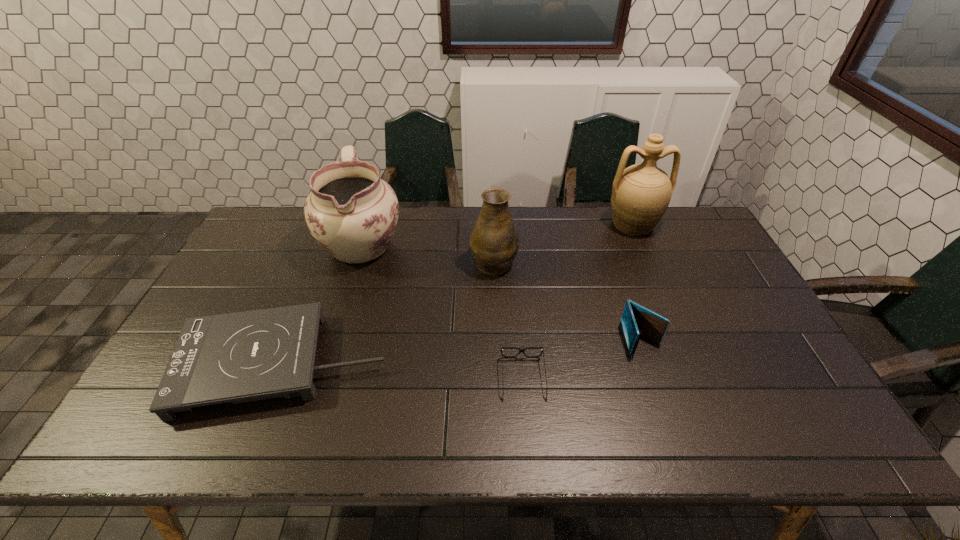
Find the location of `vacant space at the near edge of the desktop`. vacant space at the near edge of the desktop is located at coordinates (359, 440).

I want to click on vacant point at the right edge, so click(715, 253).

Locate an element on the screen. empty space that is in between the shortest object and the leftmost pitcher is located at coordinates (443, 310).

Locate an element on the screen. The width and height of the screenshot is (960, 540). vacant region between the spectacles and the leftmost pitcher is located at coordinates (443, 310).

I want to click on free space between the wallet and the second pitcher from left to right, so click(x=567, y=300).

Locate an element on the screen. The image size is (960, 540). free space between the wallet and the leftmost pitcher is located at coordinates tap(501, 292).

Locate an element on the screen. vacant region between the hotplate and the second pitcher from left to right is located at coordinates (388, 312).

Find the location of a particular element. The height and width of the screenshot is (540, 960). free spot between the spectacles and the second pitcher from right to left is located at coordinates coord(509,320).

The image size is (960, 540). Identify the location of free space between the second pitcher from left to right and the leftmost pitcher. (428, 252).

The image size is (960, 540). I want to click on empty space between the hotplate and the wallet, so click(462, 352).